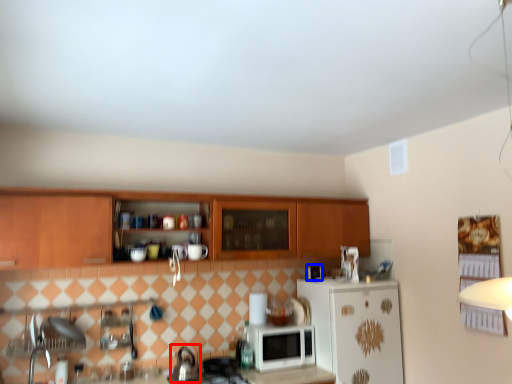
Question: Which object appears farthest to the camera in this image, tea pot (highlighted by a red box) or appliance (highlighted by a blue box)?

Choices:
 (A) tea pot
 (B) appliance

Answer: (B)